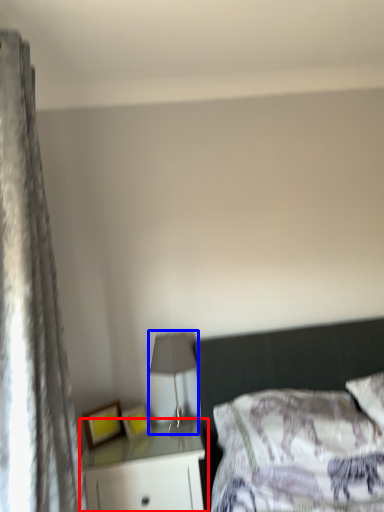
Question: Which of the following is the closest to the observer, nightstand (highlighted by a red box) or lamp (highlighted by a blue box)?

Choices:
 (A) nightstand
 (B) lamp

Answer: (A)